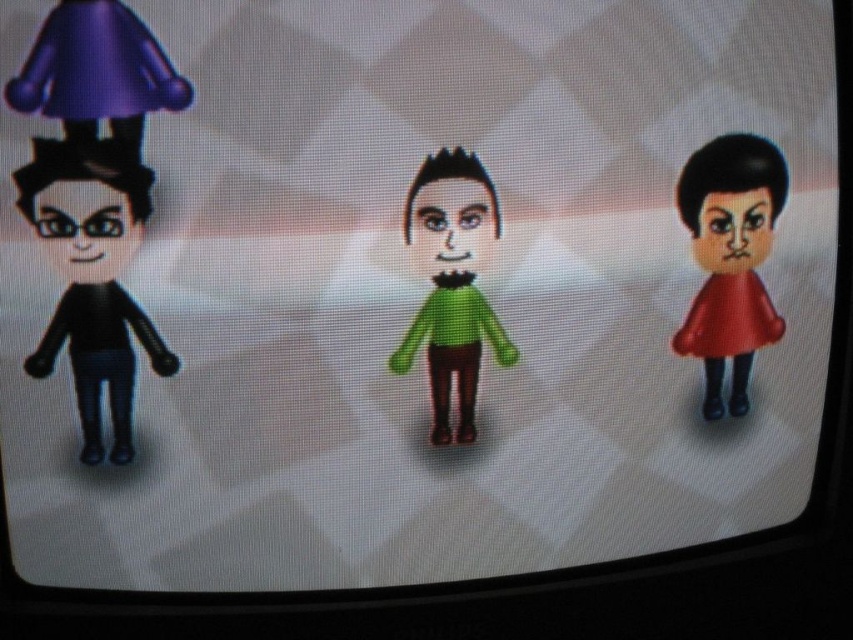
You are a game developer designing a level where the character in the middle must be positioned at a specific coordinate. What object is located at the coordinate point (x=451, y=284)?

The point (x=451, y=284) marks the green matte sweater at center.